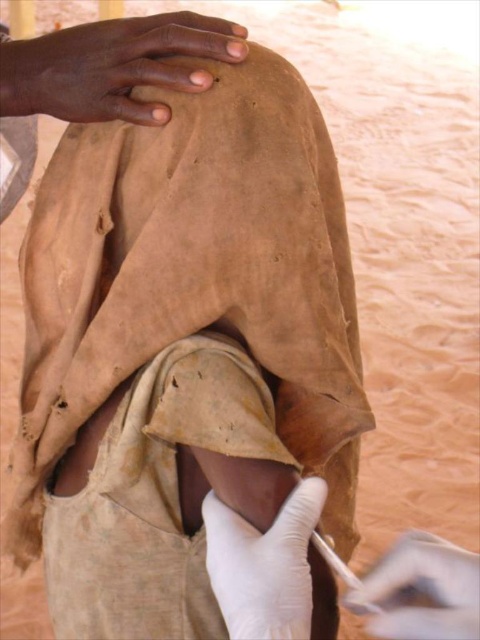
Based on the scene description, can you determine if the smooth skin hand at upper center is wider than the white latex glove at lower center?

The smooth skin hand at upper center might be wider than white latex glove at lower center according to the description.

You are a medical student observing a procedure. You see the smooth skin hand at upper center and the white latex glove at lower center. Which object is higher in the image?

The smooth skin hand at upper center is higher in the image because it is taller than the white latex glove at lower center.